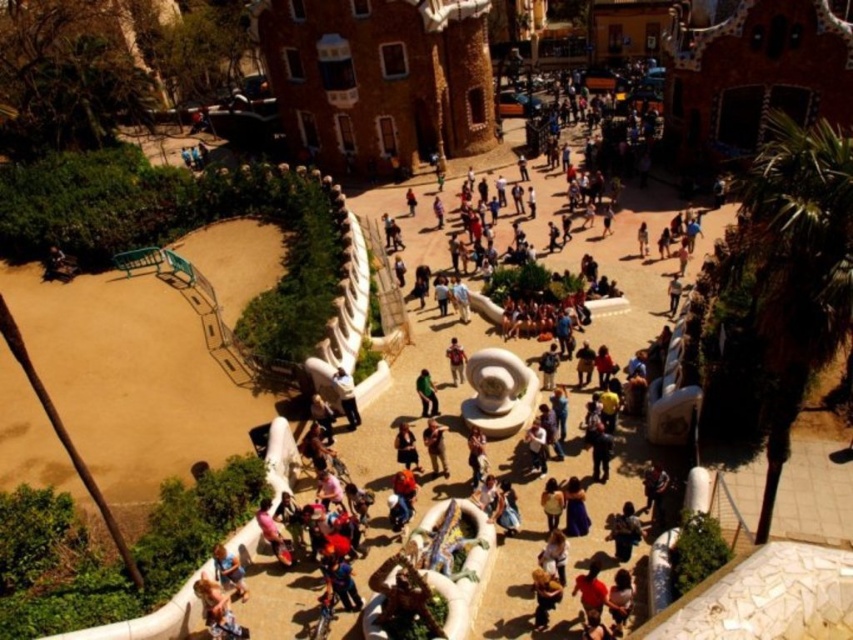
You are standing at the entrance of Parc Guell and want to find the brown leather jacket at center. According to the coordinates provided, in which direction should you walk to reach it?

The brown leather jacket at center is located at coordinates point (434, 445). Since the coordinate system typically starts at the bottom left corner, a higher x value means moving to the right and a higher y value means moving upwards. Therefore, to reach the brown leather jacket at center, you should walk towards the upper right direction from the entrance.

You are a photographer standing in the plaza at Parc Guell, and you want to take a picture of both the green matte pants at center and the matte brown backpack at center. Which object should you focus on first if you want to capture both in the same frame without moving the camera?

Since the green matte pants at center is not as tall as the matte brown backpack at center, you should focus on the taller matte brown backpack at center first to ensure both objects are in the frame.